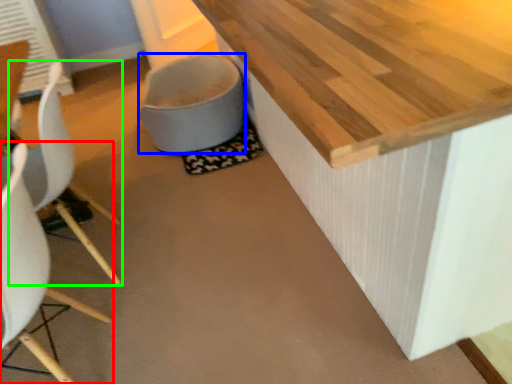
Question: Based on their relative distances, which object is farther from chair (highlighted by a red box)? Choose from toilet bowl (highlighted by a blue box) and chair (highlighted by a green box).

Choices:
 (A) toilet bowl
 (B) chair

Answer: (A)